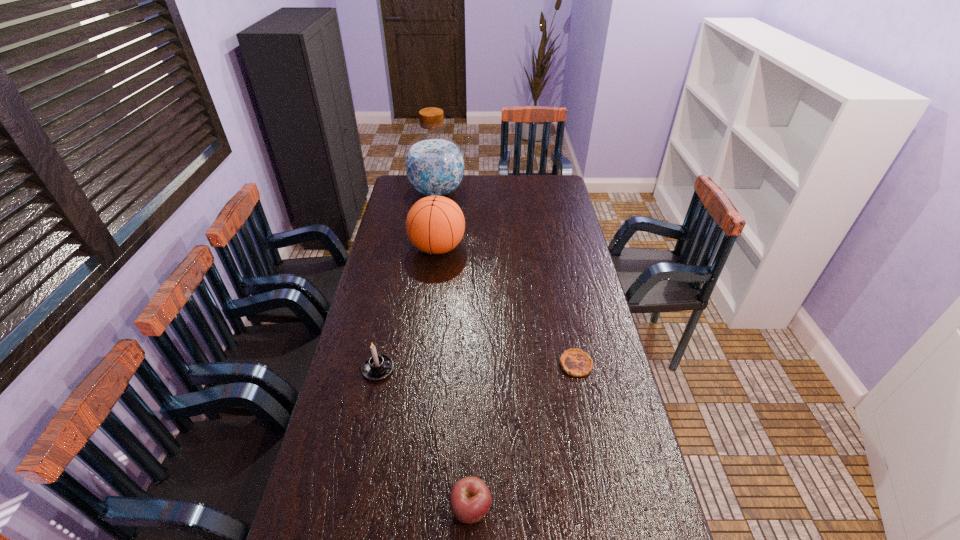
In the image, there is a desktop. Find the location of `free region at the right edge`. free region at the right edge is located at coordinates (588, 324).

In the image, there is a desktop. In order to click on vacant space at the far right corner in this screenshot , I will do `click(549, 191)`.

The height and width of the screenshot is (540, 960). Identify the location of free space between the rightmost object and the second tallest object. (507, 306).

Locate an element on the screen. This screenshot has height=540, width=960. unoccupied position between the fourth nearest object and the third shortest object is located at coordinates coord(408,308).

I want to click on vacant point located between the second shortest object and the farthest object, so click(x=454, y=350).

The height and width of the screenshot is (540, 960). I want to click on free space between the water jug and the candle holder, so click(407, 281).

Locate an element on the screen. Image resolution: width=960 pixels, height=540 pixels. free space between the water jug and the rightmost object is located at coordinates (506, 278).

Identify the location of vacant space that's between the rightmost object and the tallest object. This screenshot has width=960, height=540. (506, 278).

Locate an element on the screen. This screenshot has height=540, width=960. vacant point located between the second shortest object and the water jug is located at coordinates (454, 350).

Locate an element on the screen. This screenshot has width=960, height=540. empty location between the third tallest object and the fourth nearest object is located at coordinates (408, 308).